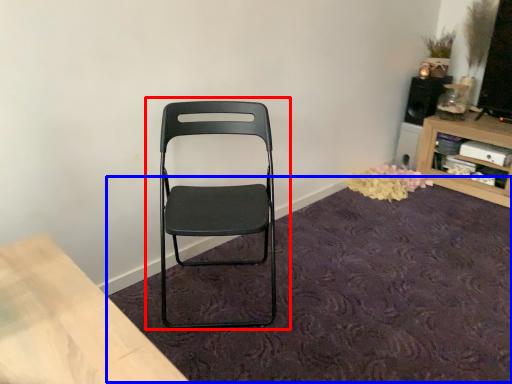
Question: Among these objects, which one is farthest to the camera, chair (highlighted by a red box) or mat (highlighted by a blue box)?

Choices:
 (A) chair
 (B) mat

Answer: (A)